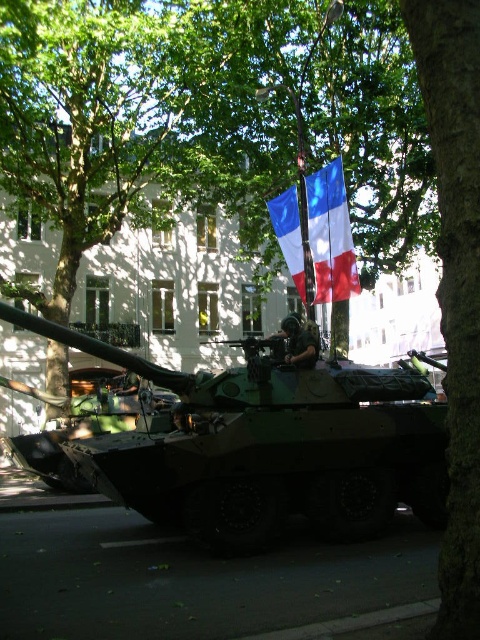
You are a photographer standing in front of the camouflage fabric tank at center and the green rough bark tree at center. You want to take a photo that captures both subjects clearly. Which subject should you focus on first to ensure both are in focus?

You should focus on the camouflage fabric tank at center first because it is closer to you than the green rough bark tree at center, so focusing on the closer subject will help keep both in focus.

Based on the scene description, if you were standing in front of the military tank, which object would be closer to your left side, the green rough bark tree at center or the blue fabric flag at center?

The green rough bark tree at center is to the left of the blue fabric flag at center, so the green rough bark tree at center would be closer to your left side.